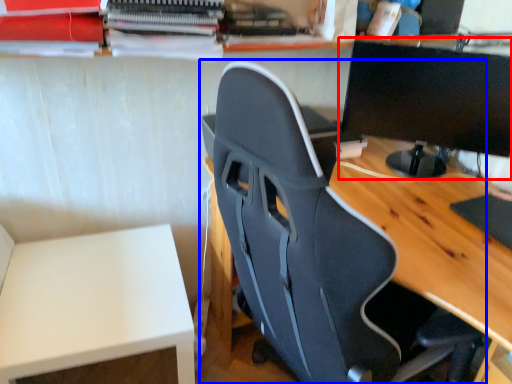
Question: Among these objects, which one is farthest to the camera, computer monitor (highlighted by a red box) or chair (highlighted by a blue box)?

Choices:
 (A) computer monitor
 (B) chair

Answer: (A)